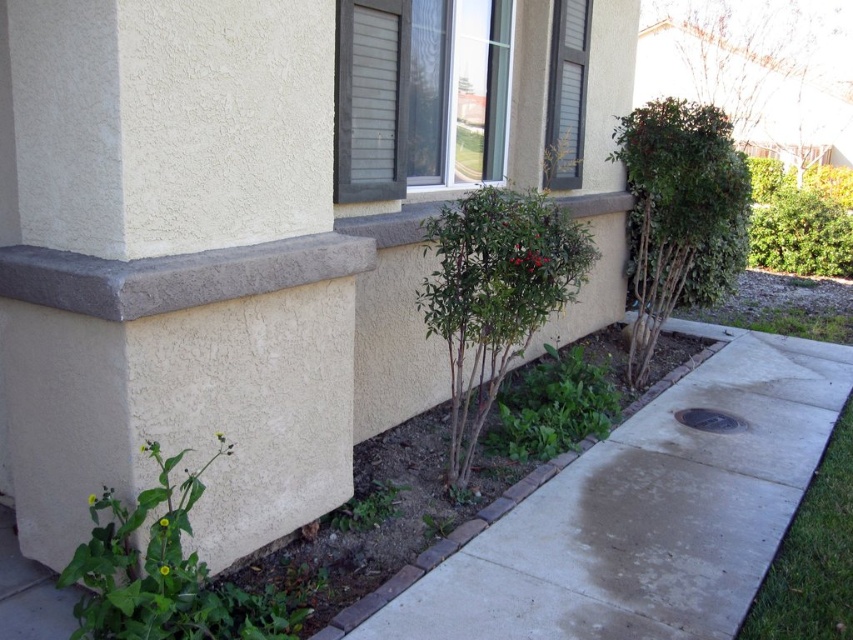
Question: Which point is farther from the camera taking this photo?

Choices:
 (A) (706, 4)
 (B) (616, 147)
 (C) (755, 400)

Answer: (A)

Question: Which point appears closest to the camera in this image?

Choices:
 (A) (70, 564)
 (B) (834, 362)
 (C) (648, 154)
 (D) (833, 452)

Answer: (A)

Question: Is green leafy bush at center above green grass at lower right?

Choices:
 (A) yes
 (B) no

Answer: (A)

Question: Can you confirm if concrete at center is bigger than green leafy bush at upper right?

Choices:
 (A) no
 (B) yes

Answer: (A)

Question: Does concrete at center have a smaller size compared to green grass at lower right?

Choices:
 (A) yes
 (B) no

Answer: (B)

Question: Among these points, which one is farthest from the camera?

Choices:
 (A) (151, 596)
 (B) (447, 282)

Answer: (B)